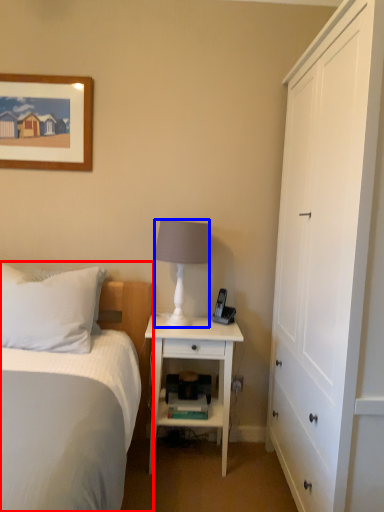
Question: Which object appears closest to the camera in this image, bed (highlighted by a red box) or lamp (highlighted by a blue box)?

Choices:
 (A) bed
 (B) lamp

Answer: (A)